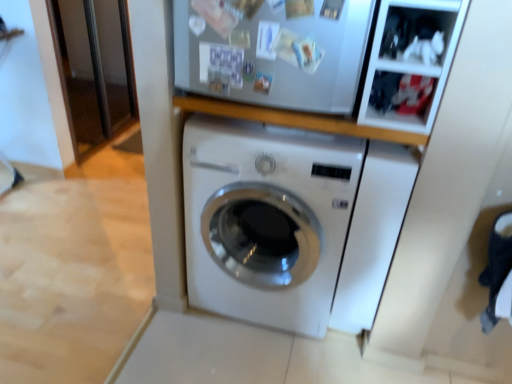
Question: Can you confirm if white glossy washing machine at center, which appears as the first washing machine when viewed from the left, is smaller than white glossy washing machine at center, acting as the 2th washing machine starting from the left?

Choices:
 (A) yes
 (B) no

Answer: (B)

Question: Does white glossy washing machine at center, the 2th washing machine positioned from the right, have a lesser width compared to white glossy washing machine at center, which appears as the first washing machine when viewed from the right?

Choices:
 (A) yes
 (B) no

Answer: (B)

Question: Is white glossy washing machine at center, which appears as the first washing machine when viewed from the left, with white glossy washing machine at center, which appears as the first washing machine when viewed from the right?

Choices:
 (A) no
 (B) yes

Answer: (A)

Question: Is white glossy washing machine at center, which appears as the first washing machine when viewed from the left, far from white glossy washing machine at center, acting as the 2th washing machine starting from the left?

Choices:
 (A) no
 (B) yes

Answer: (A)

Question: Is white glossy washing machine at center, the 2th washing machine positioned from the right, to the left of white glossy washing machine at center, acting as the 2th washing machine starting from the left, from the viewer's perspective?

Choices:
 (A) yes
 (B) no

Answer: (A)

Question: Can you confirm if white glossy washing machine at center, which appears as the first washing machine when viewed from the left, is taller than white glossy washing machine at center, acting as the 2th washing machine starting from the left?

Choices:
 (A) yes
 (B) no

Answer: (A)

Question: Is white glossy washing machine at center, acting as the 2th washing machine starting from the left, positioned beyond the bounds of white glossy washing machine at center, which appears as the first washing machine when viewed from the left?

Choices:
 (A) yes
 (B) no

Answer: (A)

Question: Is white glossy washing machine at center, acting as the 2th washing machine starting from the left, shorter than white glossy washing machine at center, which appears as the first washing machine when viewed from the left?

Choices:
 (A) no
 (B) yes

Answer: (B)

Question: Considering the relative sizes of white glossy washing machine at center, which appears as the first washing machine when viewed from the right, and white glossy washing machine at center, which appears as the first washing machine when viewed from the left, in the image provided, is white glossy washing machine at center, which appears as the first washing machine when viewed from the right, taller than white glossy washing machine at center, which appears as the first washing machine when viewed from the left,?

Choices:
 (A) yes
 (B) no

Answer: (B)

Question: Is white glossy washing machine at center, acting as the 2th washing machine starting from the left, bigger than white glossy washing machine at center, which appears as the first washing machine when viewed from the left?

Choices:
 (A) no
 (B) yes

Answer: (A)

Question: Is white glossy washing machine at center, acting as the 2th washing machine starting from the left, positioned far away from white glossy washing machine at center, the 2th washing machine positioned from the right?

Choices:
 (A) no
 (B) yes

Answer: (A)

Question: Is white glossy washing machine at center, which appears as the first washing machine when viewed from the right, facing towards white glossy washing machine at center, the 2th washing machine positioned from the right?

Choices:
 (A) yes
 (B) no

Answer: (B)

Question: In terms of size, does white glossy washing machine at center, which appears as the first washing machine when viewed from the right, appear bigger or smaller than white glossy washing machine at center, which appears as the first washing machine when viewed from the left?

Choices:
 (A) big
 (B) small

Answer: (B)